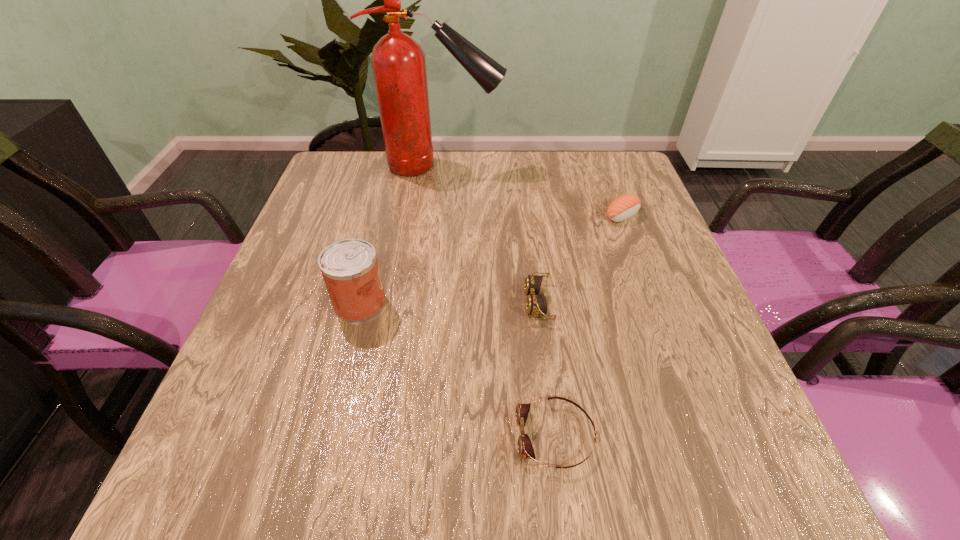
This screenshot has width=960, height=540. Identify the location of fire extinguisher located in the left edge section of the desktop. (398, 62).

The width and height of the screenshot is (960, 540). Find the location of `can present at the left edge`. can present at the left edge is located at coordinates (349, 267).

The width and height of the screenshot is (960, 540). I want to click on object situated at the right edge, so click(x=625, y=206).

I want to click on object located in the far left corner section of the desktop, so click(x=398, y=62).

Image resolution: width=960 pixels, height=540 pixels. What are the coordinates of `free point at the far edge` in the screenshot? It's located at (542, 186).

Identify the location of vacant space at the near edge of the desktop. (615, 485).

Identify the location of free space at the left edge of the desktop. (369, 205).

Where is `free space at the right edge of the desktop`? This screenshot has height=540, width=960. free space at the right edge of the desktop is located at coordinates (731, 389).

Locate an element on the screen. The image size is (960, 540). free spot at the far left corner of the desktop is located at coordinates (334, 184).

Find the location of a particular element. free location at the far right corner of the desktop is located at coordinates (615, 171).